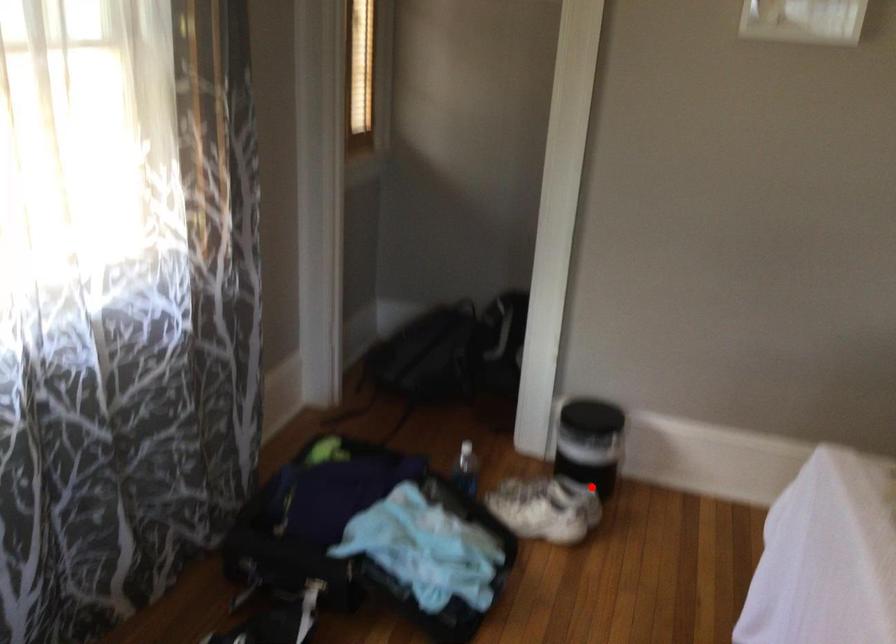
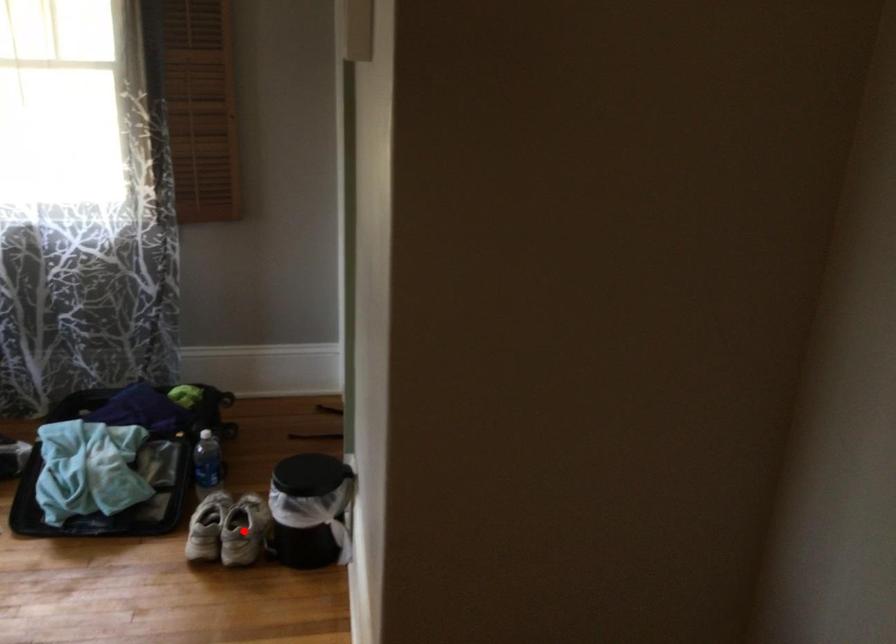
I am providing you with two images of the same scene from different viewpoints. A red point is marked on the first image and another point is marked on the second image. Are the points marked in image1 and image2 representing the same 3D position?

Yes